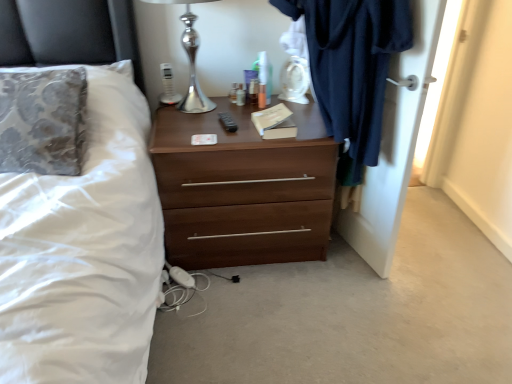
What are the coordinates of `free spot above brown wood chest of drawers at center (from a real-world perspective)` in the screenshot? It's located at (219, 120).